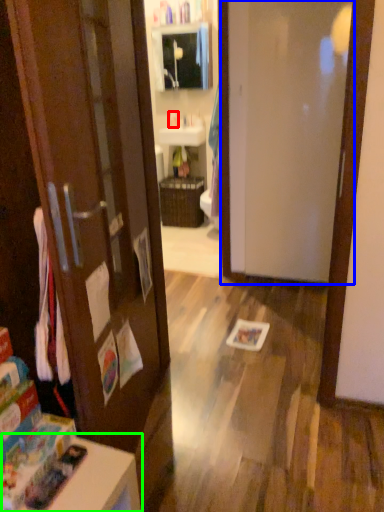
Question: Based on their relative distances, which object is nearer to toiletry (highlighted by a red box)? Choose from door (highlighted by a blue box) and table (highlighted by a green box).

Choices:
 (A) door
 (B) table

Answer: (A)